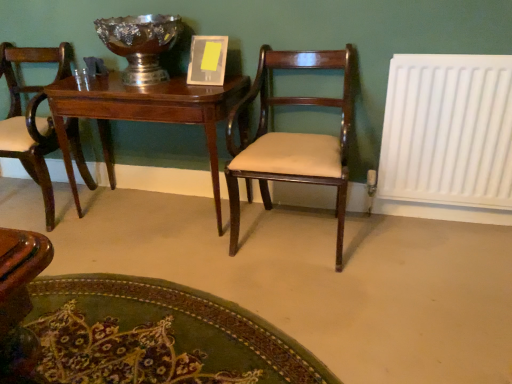
The image size is (512, 384). In order to click on vacant space in between mahogany wood chair at center, which is the 2th chair in left-to-right order, and white plastic radiator at right in this screenshot , I will do [398, 241].